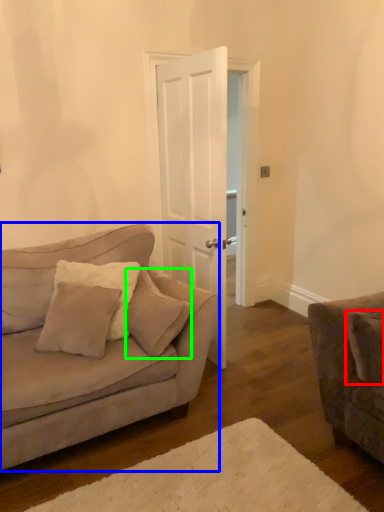
Question: Considering the real-world distances, which object is farthest from pillow (highlighted by a red box)? studio couch (highlighted by a blue box) or pillow (highlighted by a green box)?

Choices:
 (A) studio couch
 (B) pillow

Answer: (A)